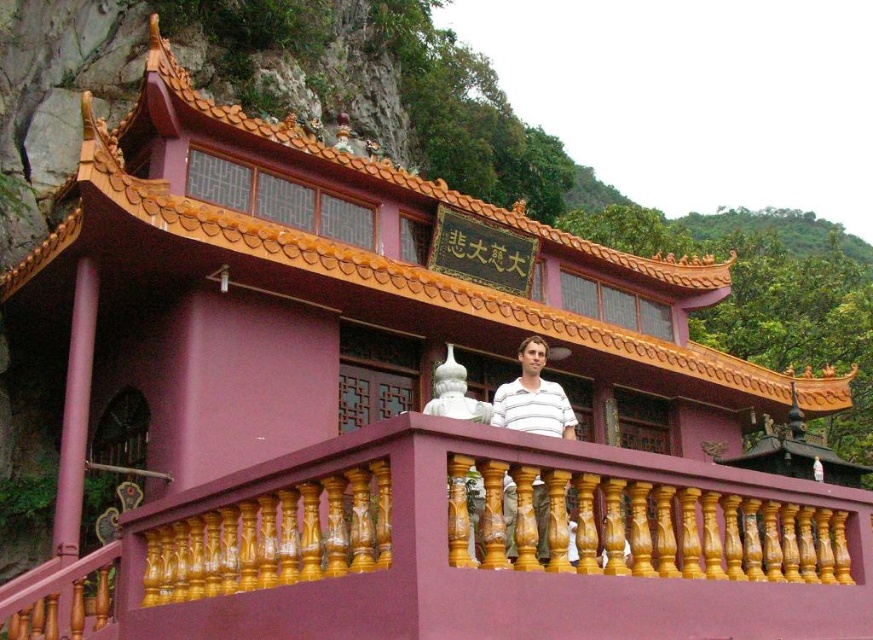
You are a visitor at the pavilion and want to take a photo of the wooden at center and the white striped shirt at center. Which object should you focus on first if you want to capture both in the frame without moving the camera?

You should focus on the wooden at center first because it is taller than the white striped shirt at center, so adjusting the camera angle to include its full height will naturally include the shorter object in the frame.

You are standing in front of a traditional Chinese pavilion and want to take a photo of the point at coordinates point (754, 552). If your camera has a maximum focus range of 25 meters, will you be able to focus on that point?

The distance of point (754, 552) from the camera is 26.29 meters, which exceeds the camera maximum focus range of 25 meters. Therefore, the camera cannot focus on that point.

You are standing in front of the pavilion and see the wooden at center and the white striped shirt at center. Which object is positioned lower in the scene?

The wooden at center is located below the white striped shirt at center, so it is positioned lower in the scene.